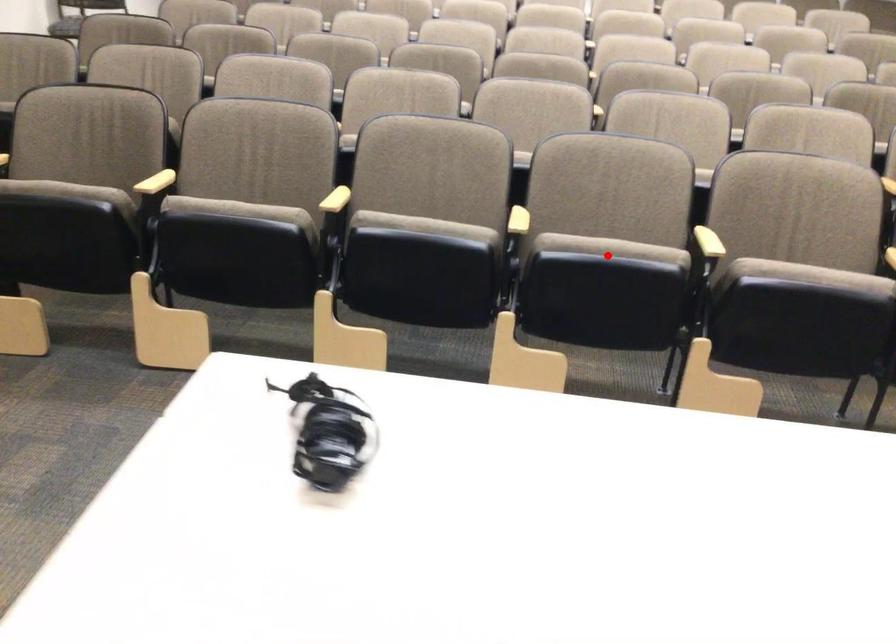
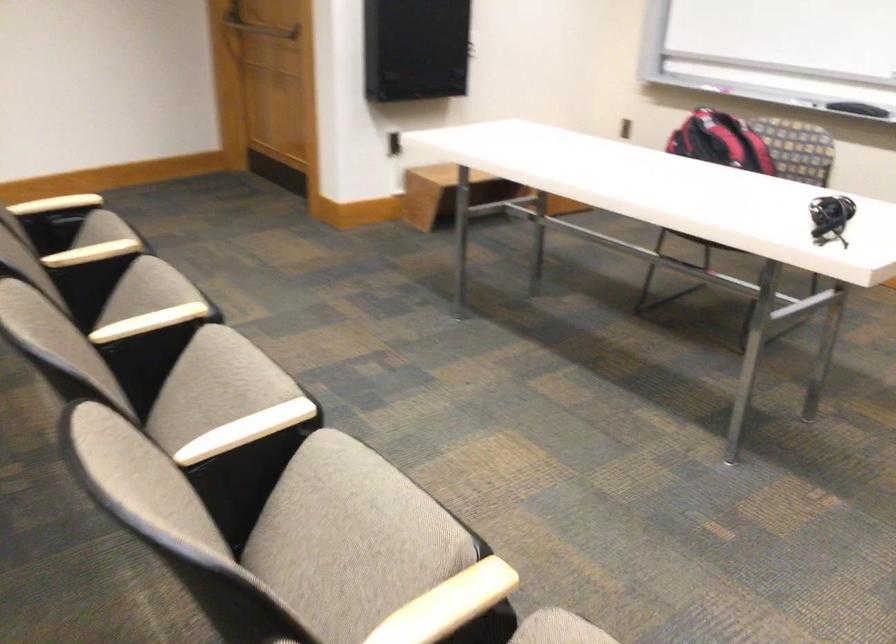
Question: I am providing you with two images of the same scene from different viewpoints. Given a red point in image1, look at the same physical point in image2. Is it:

Choices:
 (A) Closer to the viewpoint
 (B) Farther from the viewpoint

Answer: (A)